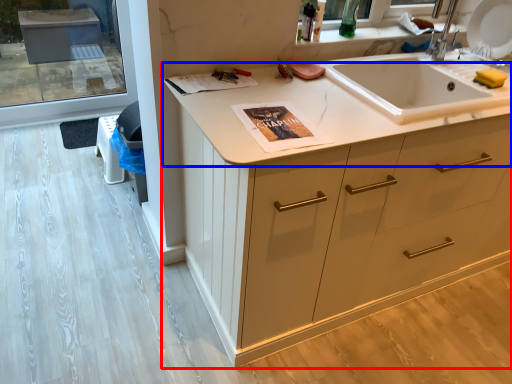
Question: Which object appears closest to the camera in this image, cabinetry (highlighted by a red box) or countertop (highlighted by a blue box)?

Choices:
 (A) cabinetry
 (B) countertop

Answer: (A)